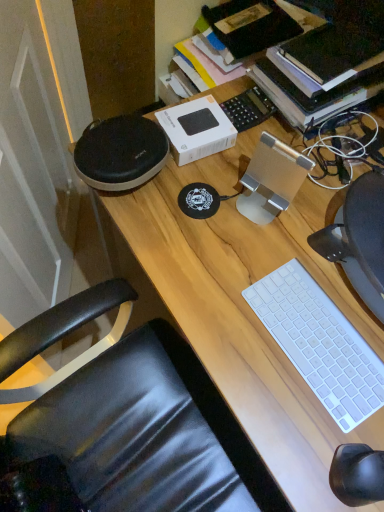
Question: Is wooden desk at center in front of or behind white plastic keyboard at lower right in the image?

Choices:
 (A) front
 (B) behind

Answer: (A)

Question: Considering the positions of wooden desk at center and white plastic keyboard at lower right in the image, is wooden desk at center taller or shorter than white plastic keyboard at lower right?

Choices:
 (A) tall
 (B) short

Answer: (A)

Question: In the image, is wooden desk at center on the left side or the right side of white plastic keyboard at lower right?

Choices:
 (A) right
 (B) left

Answer: (A)

Question: From a real-world perspective, is white plastic keyboard at lower right positioned above or below wooden desk at center?

Choices:
 (A) below
 (B) above

Answer: (B)

Question: Is white plastic keyboard at lower right taller or shorter than wooden desk at center?

Choices:
 (A) short
 (B) tall

Answer: (A)

Question: From the image's perspective, is white plastic keyboard at lower right located above or below wooden desk at center?

Choices:
 (A) above
 (B) below

Answer: (A)

Question: Looking at their shapes, would you say white plastic keyboard at lower right is wider or thinner than wooden desk at center?

Choices:
 (A) thin
 (B) wide

Answer: (A)